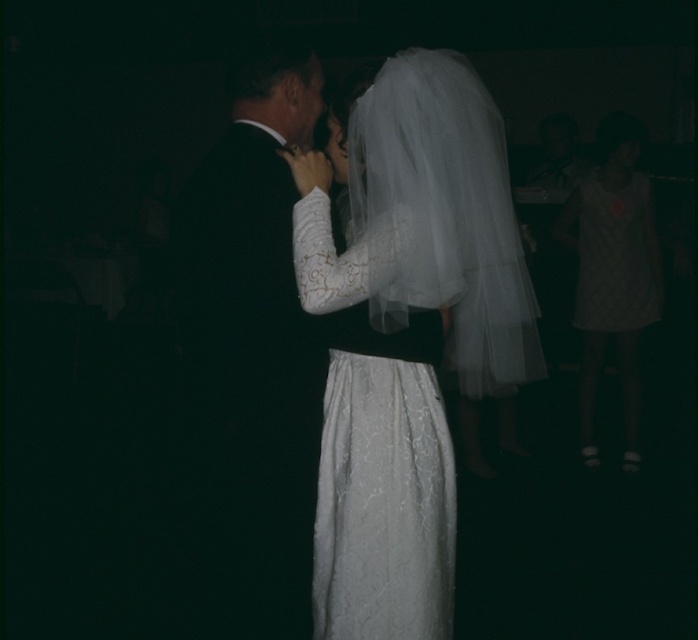
Question: Can you confirm if white quilted dress at right is thinner than white quilted fabric dress at right?

Choices:
 (A) no
 (B) yes

Answer: (A)

Question: Among these objects, which one is farthest from the camera?

Choices:
 (A) matte black suit at center
 (B) white quilted dress at right

Answer: (B)

Question: Is white lace dress at center bigger than white quilted dress at right?

Choices:
 (A) no
 (B) yes

Answer: (A)

Question: In this image, where is matte black suit at center located relative to white quilted dress at right?

Choices:
 (A) right
 (B) left

Answer: (B)

Question: Which point is closer to the camera?

Choices:
 (A) matte black suit at center
 (B) white lace dress at center
 (C) white quilted dress at right
 (D) white quilted fabric dress at right

Answer: (B)

Question: Estimate the real-world distances between objects in this image. Which object is farther from the matte black suit at center?

Choices:
 (A) white lace dress at center
 (B) white quilted fabric dress at right
 (C) white quilted dress at right

Answer: (B)